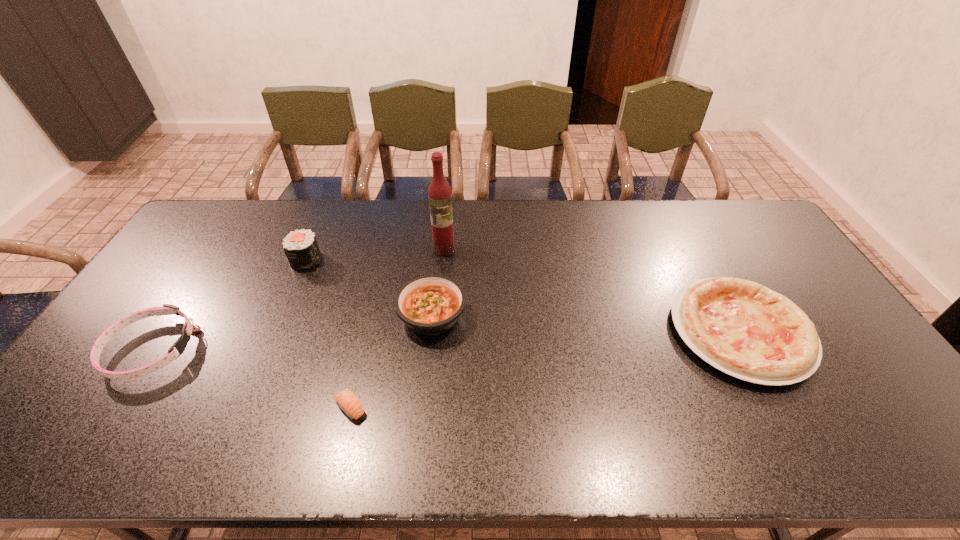
Identify which object is the fifth nearest to the tallest object. Please provide its 2D coordinates. Your answer should be formatted as a tuple, i.e. [(x, y)], where the tuple contains the x and y coordinates of a point satisfying the conditions above.

[(168, 309)]

You are a GUI agent. You are given a task and a screenshot of the screen. Output one action in this format:
    pyautogui.click(x=<x>, y=<y>)
    Task: Click on the vacant space that satisfies the following two spatial constraints: 1. on the back side of the pizza; 2. on the left side of the nearer sushi
    The image size is (960, 540).
    Given the screenshot: What is the action you would take?
    pyautogui.click(x=368, y=332)

Where is `free space that satisfies the following two spatial constraints: 1. on the front side of the stew; 2. with the buckle on the leftmost object`? Image resolution: width=960 pixels, height=540 pixels. free space that satisfies the following two spatial constraints: 1. on the front side of the stew; 2. with the buckle on the leftmost object is located at coordinates (429, 349).

The image size is (960, 540). I want to click on free space in the image that satisfies the following two spatial constraints: 1. with the buckle on the dog collar; 2. on the right side of the third object from left to right, so click(x=112, y=408).

I want to click on vacant area in the image that satisfies the following two spatial constraints: 1. on the back side of the right sushi; 2. with the buckle on the leftmost object, so click(x=364, y=349).